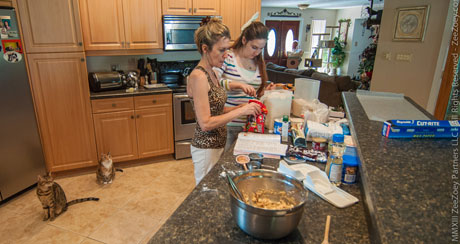
The width and height of the screenshot is (460, 244). Find the location of `pot`. pot is located at coordinates (282, 227).